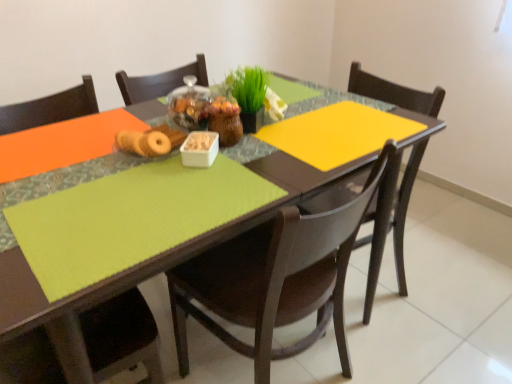
Identify the location of empty space that is ontop of lime green fabric table at center (from a real-world perspective). The width and height of the screenshot is (512, 384). (179, 167).